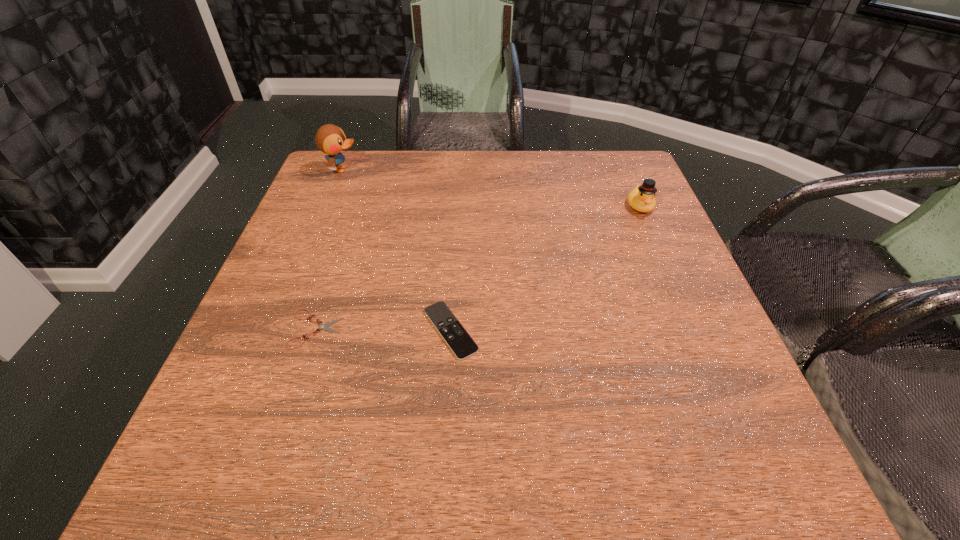
At what (x,y) coordinates should I click in order to perform the action: click on free space at the far right corner of the desktop. Please return your answer as a coordinate pair (x, y). Looking at the image, I should click on (632, 174).

Locate an element on the screen. vacant space that's between the second object from right to left and the nearer duck is located at coordinates (545, 268).

You are a GUI agent. You are given a task and a screenshot of the screen. Output one action in this format:
    pyautogui.click(x=<x>, y=<y>)
    Task: Click on the blank region between the shears and the second object from right to left
    This screenshot has height=540, width=960.
    Given the screenshot: What is the action you would take?
    pyautogui.click(x=383, y=329)

The height and width of the screenshot is (540, 960). In order to click on free point between the tallest object and the third nearest object in this screenshot , I will do `click(491, 188)`.

Find the location of `free area in between the shears and the remote control`. free area in between the shears and the remote control is located at coordinates (383, 329).

The width and height of the screenshot is (960, 540). I want to click on vacant area between the nearer duck and the third tallest object, so click(x=545, y=268).

You are a GUI agent. You are given a task and a screenshot of the screen. Output one action in this format:
    pyautogui.click(x=<x>, y=<y>)
    Task: Click on the unoccupied position between the remote control and the shears
    The height and width of the screenshot is (540, 960).
    Given the screenshot: What is the action you would take?
    pyautogui.click(x=383, y=329)

Find the location of a particular element. free space that is in between the second object from right to left and the farther duck is located at coordinates (396, 250).

Locate an element on the screen. The height and width of the screenshot is (540, 960). free space between the shortest object and the remote control is located at coordinates (383, 329).

Locate an element on the screen. Image resolution: width=960 pixels, height=540 pixels. free space that is in between the shortest object and the left duck is located at coordinates (329, 249).